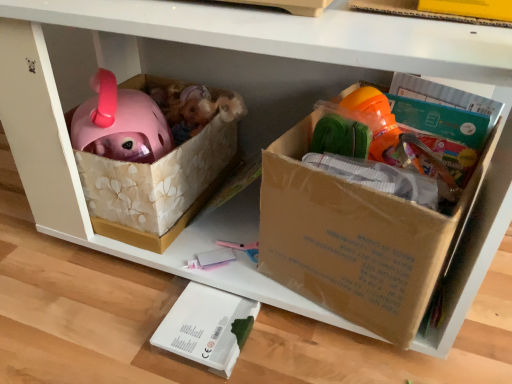
I want to click on white matte box at lower center, so click(205, 327).

Describe the element at coordinates (205, 327) in the screenshot. I see `white matte box at lower center` at that location.

Describe the element at coordinates (372, 241) in the screenshot. The image size is (512, 384). I see `brown cardboard box at center` at that location.

Where is `brown cardboard box at center`? The width and height of the screenshot is (512, 384). brown cardboard box at center is located at coordinates (372, 241).

What are the coordinates of `white matte box at lower center` in the screenshot? It's located at (205, 327).

Considering the positions of objects white matte box at lower center and brown cardboard box at center in the image provided, who is more to the right, white matte box at lower center or brown cardboard box at center?

From the viewer's perspective, brown cardboard box at center appears more on the right side.

Which object is closer to the camera taking this photo, white matte box at lower center or brown cardboard box at center?

brown cardboard box at center.

Is point (198, 328) positioned after point (316, 255)?

Yes, it is behind point (316, 255).

From the image's perspective, which one is positioned lower, white matte box at lower center or brown cardboard box at center?

From the image's view, white matte box at lower center is below.

From a real-world perspective, is white matte box at lower center positioned under brown cardboard box at center based on gravity?

Correct, in the physical world, white matte box at lower center is lower than brown cardboard box at center.

Which object is wider, white matte box at lower center or brown cardboard box at center?

Wider between the two is brown cardboard box at center.

Who is shorter, white matte box at lower center or brown cardboard box at center?

With less height is white matte box at lower center.

Can you confirm if white matte box at lower center is bigger than brown cardboard box at center?

No.

Can we say white matte box at lower center lies outside brown cardboard box at center?

Yes, white matte box at lower center is located beyond the bounds of brown cardboard box at center.

Would you say white matte box at lower center is a long distance from brown cardboard box at center?

white matte box at lower center is near brown cardboard box at center, not far away.

Is white matte box at lower center oriented towards brown cardboard box at center?

No, white matte box at lower center is not oriented towards brown cardboard box at center.

Can you tell me how much white matte box at lower center and brown cardboard box at center differ in facing direction?

The angular difference between white matte box at lower center and brown cardboard box at center is 3.74e-05 degrees.

Image resolution: width=512 pixels, height=384 pixels. In order to click on box below the brown cardboard box at center (from the image's perspective) in this screenshot , I will do `click(205, 327)`.

Which object is positioned more to the left, brown cardboard box at center or white matte box at lower center?

Positioned to the left is white matte box at lower center.

Is the depth of brown cardboard box at center greater than that of white matte box at lower center?

No, it is not.

Considering the points (306, 271) and (201, 318), which point is in front, point (306, 271) or point (201, 318)?

The point (306, 271) is closer.

From the image's perspective, which one is positioned higher, brown cardboard box at center or white matte box at lower center?

brown cardboard box at center, from the image's perspective.

From a real-world perspective, is brown cardboard box at center above or below white matte box at lower center?

From a real-world perspective, brown cardboard box at center is physically above white matte box at lower center.

Does brown cardboard box at center have a greater width compared to white matte box at lower center?

Correct, the width of brown cardboard box at center exceeds that of white matte box at lower center.

Considering the relative sizes of brown cardboard box at center and white matte box at lower center in the image provided, is brown cardboard box at center shorter than white matte box at lower center?

No, brown cardboard box at center is not shorter than white matte box at lower center.

In terms of size, does brown cardboard box at center appear bigger or smaller than white matte box at lower center?

brown cardboard box at center is bigger than white matte box at lower center.

Choose the correct answer: Is brown cardboard box at center inside white matte box at lower center or outside it?

brown cardboard box at center is not enclosed by white matte box at lower center.

Looking at this image, is brown cardboard box at center directly adjacent to white matte box at lower center?

No, brown cardboard box at center is not with white matte box at lower center.

Is white matte box at lower center at the back of brown cardboard box at center?

No, brown cardboard box at center is not facing the opposite direction of white matte box at lower center.

Can you tell me how much brown cardboard box at center and white matte box at lower center differ in facing direction?

3.74e-05 degrees.

Identify the location of box below the brown cardboard box at center (from the image's perspective). (205, 327).

Where is `box below the brown cardboard box at center (from a real-world perspective)`? The width and height of the screenshot is (512, 384). box below the brown cardboard box at center (from a real-world perspective) is located at coordinates (205, 327).

Locate an element on the screen. The height and width of the screenshot is (384, 512). box on the left of brown cardboard box at center is located at coordinates (205, 327).